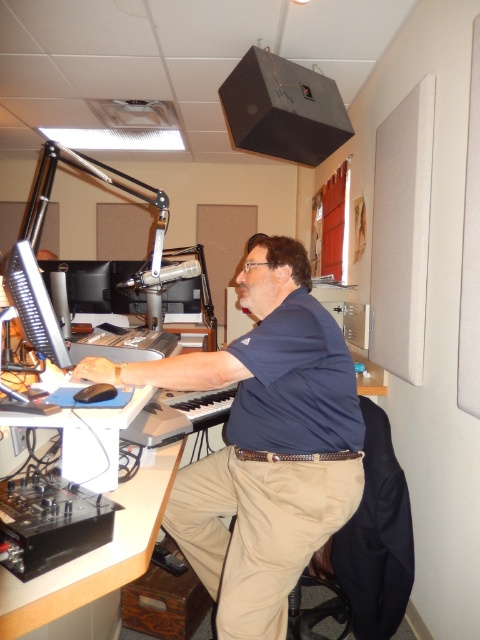
Question: Which point is farther to the camera?

Choices:
 (A) black mesh swivel chair at lower right
 (B) matte black monitor at left
 (C) dark blue shirt at center

Answer: (A)

Question: Which of the following is the closest to the observer?

Choices:
 (A) (56, 589)
 (B) (237, 378)

Answer: (A)

Question: Which of these objects is positioned farthest from the dark blue shirt at center?

Choices:
 (A) matte black monitor at left
 (B) black mesh swivel chair at lower right

Answer: (B)

Question: Can you confirm if dark blue shirt at center is thinner than white plastic computer desk at lower left?

Choices:
 (A) yes
 (B) no

Answer: (B)

Question: Does dark blue shirt at center have a greater width compared to black mesh swivel chair at lower right?

Choices:
 (A) no
 (B) yes

Answer: (B)

Question: Is dark blue shirt at center to the left of white plastic computer desk at lower left from the viewer's perspective?

Choices:
 (A) no
 (B) yes

Answer: (A)